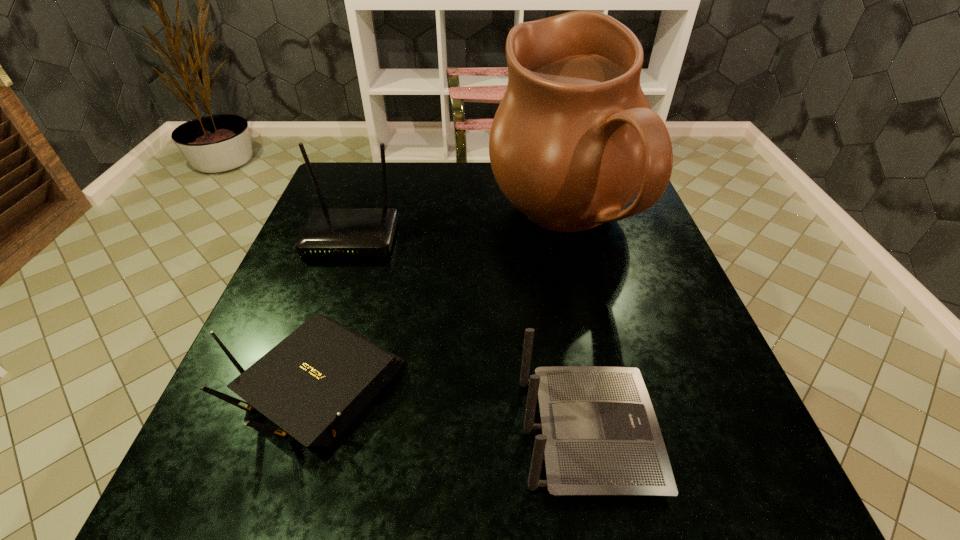
You are a GUI agent. You are given a task and a screenshot of the screen. Output one action in this format:
    pyautogui.click(x=<x>, y=<y>)
    Task: Click on the free location that satisfies the following two spatial constraints: 1. on the front side of the shortest router; 2. on the front-facing side of the rightmost router
    The image size is (960, 540).
    Given the screenshot: What is the action you would take?
    coord(301,433)

Find the location of a particular element. vacant point that satisfies the following two spatial constraints: 1. at the spout of the cream pitcher; 2. on the front-facing side of the tallest router is located at coordinates (567, 238).

The height and width of the screenshot is (540, 960). I want to click on free space in the image that satisfies the following two spatial constraints: 1. on the front-facing side of the third tallest object; 2. on the front side of the shortest router, so click(579, 383).

The width and height of the screenshot is (960, 540). I want to click on vacant area that satisfies the following two spatial constraints: 1. on the front-facing side of the shortest router; 2. on the left side of the farthest router, so click(x=301, y=383).

This screenshot has width=960, height=540. I want to click on vacant space that satisfies the following two spatial constraints: 1. on the front-facing side of the second shortest object; 2. on the front-facing side of the farthest router, so click(x=551, y=238).